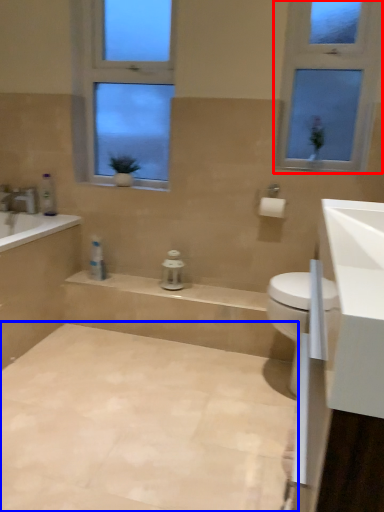
Question: Among these objects, which one is farthest to the camera, window (highlighted by a red box) or plain (highlighted by a blue box)?

Choices:
 (A) window
 (B) plain

Answer: (A)